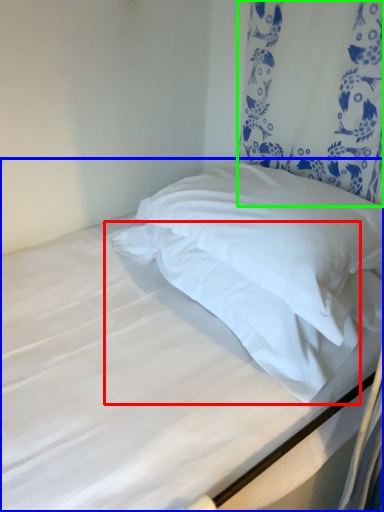
Question: Considering the real-world distances, which object is farthest from pillow (highlighted by a red box)? bed (highlighted by a blue box) or curtain (highlighted by a green box)?

Choices:
 (A) bed
 (B) curtain

Answer: (B)